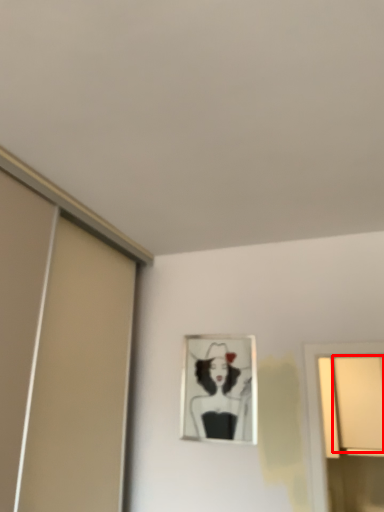
Question: From the image's perspective, what is the correct spatial relationship of window (annotated by the red box) in relation to picture frame?

Choices:
 (A) above
 (B) below

Answer: (B)